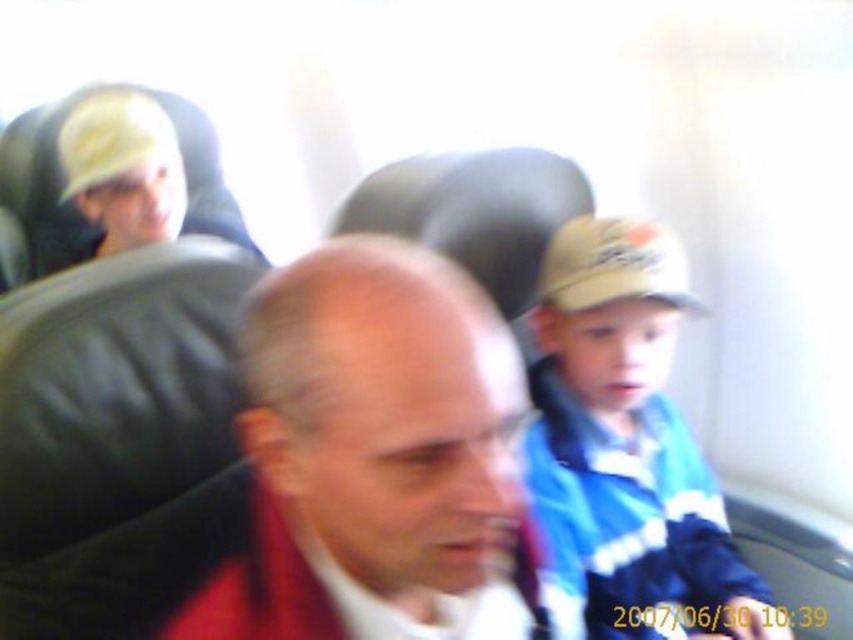
Does blue and white striped shirt at center have a lesser width compared to tan fabric baseball cap at center-right?

Incorrect, blue and white striped shirt at center's width is not less than tan fabric baseball cap at center-right's.

Is blue and white striped shirt at center in front of tan fabric baseball cap at center-right?

Yes, blue and white striped shirt at center is closer to the viewer.

What do you see at coordinates (625, 442) in the screenshot? The height and width of the screenshot is (640, 853). I see `blue and white striped shirt at center` at bounding box center [625, 442].

The image size is (853, 640). What are the coordinates of `blue and white striped shirt at center` in the screenshot? It's located at pos(625,442).

From the picture: Does smooth red shirt at center have a greater width compared to blue and white striped shirt at center?

In fact, smooth red shirt at center might be narrower than blue and white striped shirt at center.

Which is below, smooth red shirt at center or blue and white striped shirt at center?

blue and white striped shirt at center is below.

Which is in front, point (289, 385) or point (555, 554)?

Positioned in front is point (289, 385).

I want to click on smooth red shirt at center, so click(x=376, y=458).

Measure the distance between smooth red shirt at center and tan fabric baseball cap at center-right.

smooth red shirt at center and tan fabric baseball cap at center-right are 23.16 inches apart from each other.

Is smooth red shirt at center to the right of tan fabric baseball cap at center-right from the viewer's perspective?

Incorrect, smooth red shirt at center is not on the right side of tan fabric baseball cap at center-right.

Locate an element on the screen. The height and width of the screenshot is (640, 853). smooth red shirt at center is located at coordinates (376, 458).